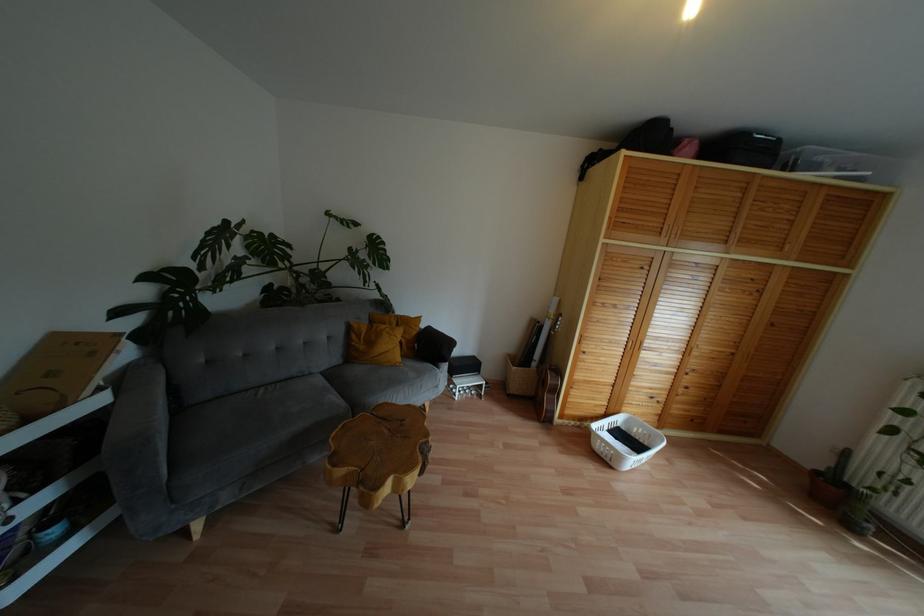
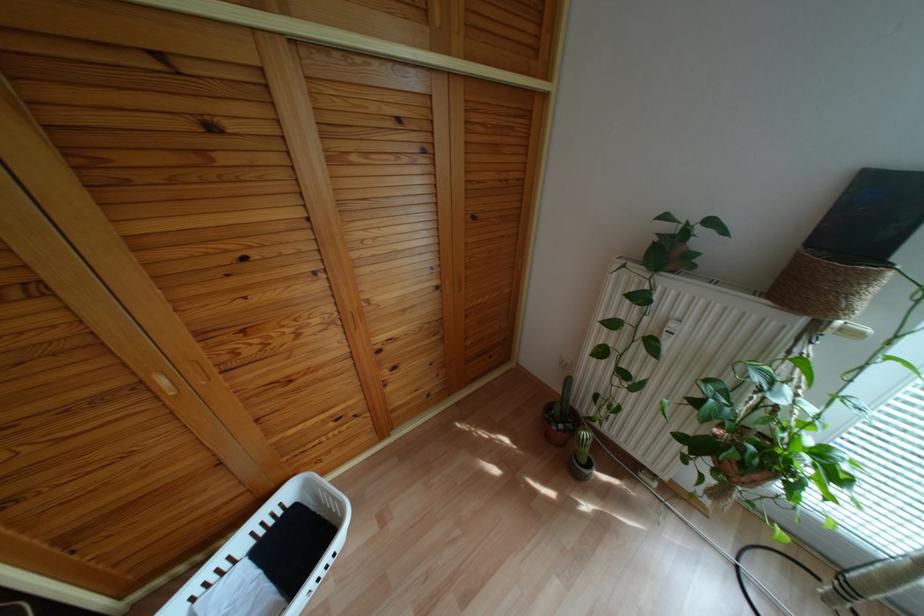
Find the pixel in the second image that matches pixel 616 419 in the first image.

(287, 493)